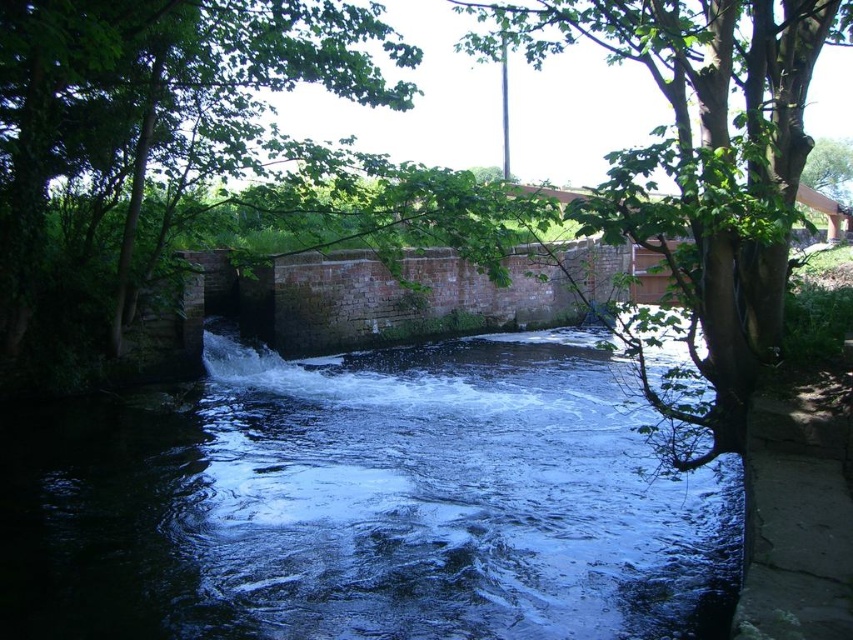
Question: Is dark blue water at center thinner than green leafy tree at upper right?

Choices:
 (A) yes
 (B) no

Answer: (A)

Question: Which object is closer to the camera taking this photo?

Choices:
 (A) green leafy tree at upper right
 (B) dark blue water at center

Answer: (A)

Question: Which point appears farthest from the camera in this image?

Choices:
 (A) (312, 417)
 (B) (680, 323)

Answer: (A)

Question: Does dark blue water at center have a lesser width compared to green leafy tree at upper right?

Choices:
 (A) no
 (B) yes

Answer: (B)

Question: Can you confirm if dark blue water at center is smaller than green leafy tree at upper right?

Choices:
 (A) no
 (B) yes

Answer: (B)